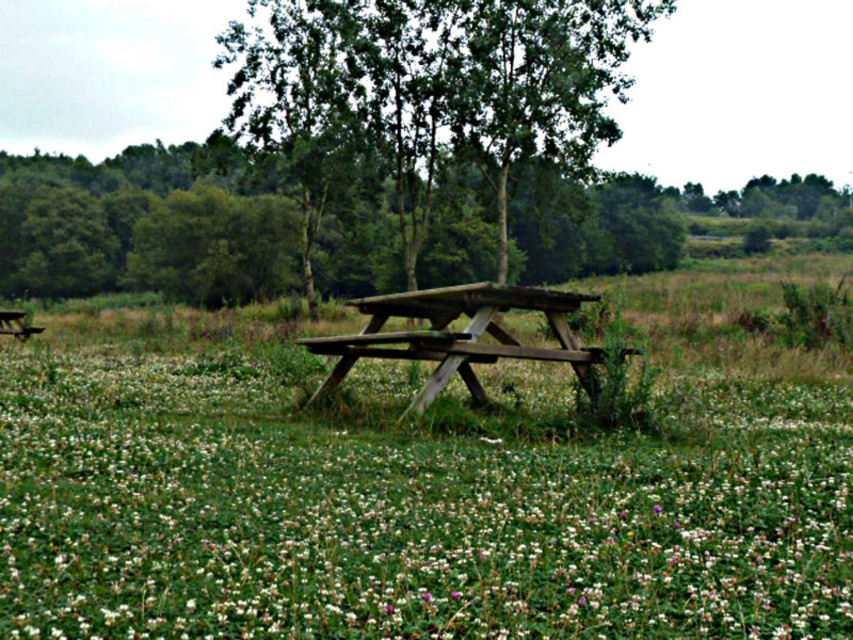
Question: Which point appears farthest from the camera in this image?

Choices:
 (A) (172, 627)
 (B) (531, 44)

Answer: (B)

Question: Considering the real-world distances, which object is closest to the wooden picnic table at center?

Choices:
 (A) green wood tree at center
 (B) white matte flower at center

Answer: (B)

Question: Does white matte flower at center have a greater width compared to wooden picnic table at center?

Choices:
 (A) no
 (B) yes

Answer: (B)

Question: Where is white matte flower at center located in relation to green wood tree at center in the image?

Choices:
 (A) below
 (B) above

Answer: (A)

Question: Can you confirm if green wood tree at center is smaller than wooden picnic table at center?

Choices:
 (A) yes
 (B) no

Answer: (B)

Question: Which object is farther from the camera taking this photo?

Choices:
 (A) green wood tree at center
 (B) white matte flower at center

Answer: (A)